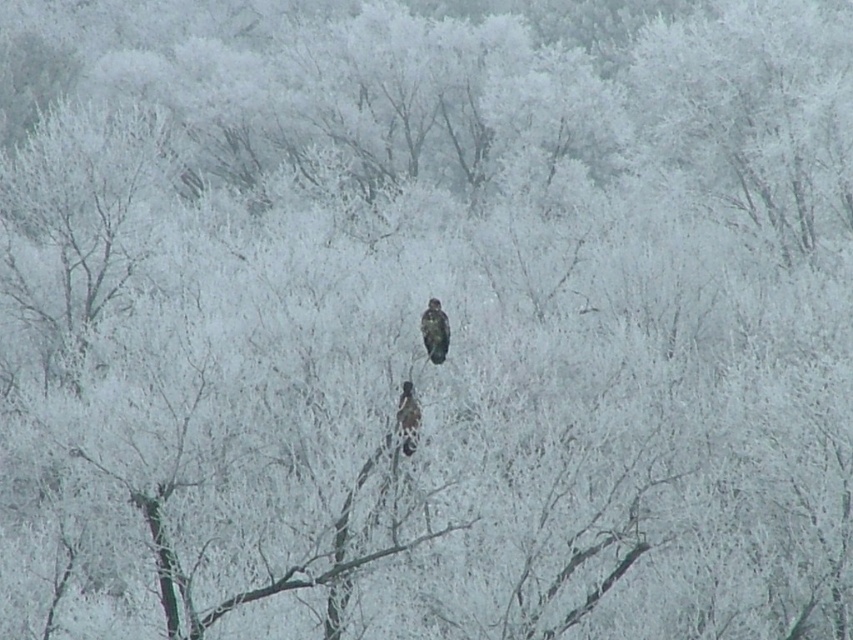
Is brown feathered bird at center below dark brown feathers at center?

No.

Does brown feathered bird at center have a smaller size compared to dark brown feathers at center?

No, brown feathered bird at center is not smaller than dark brown feathers at center.

Is point (428, 353) farther from viewer compared to point (409, 394)?

Yes, point (428, 353) is behind point (409, 394).

Identify the location of brown feathered bird at center. (434, 332).